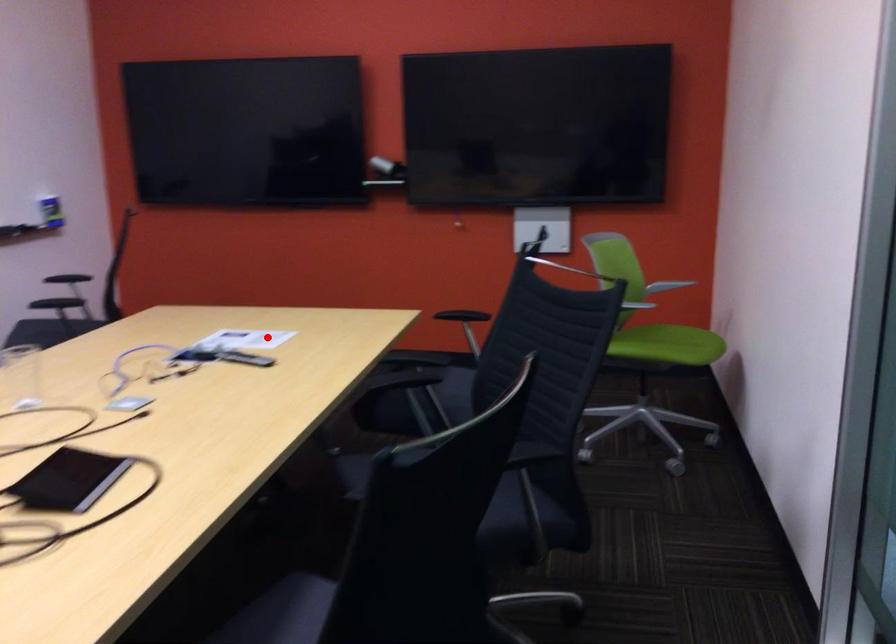
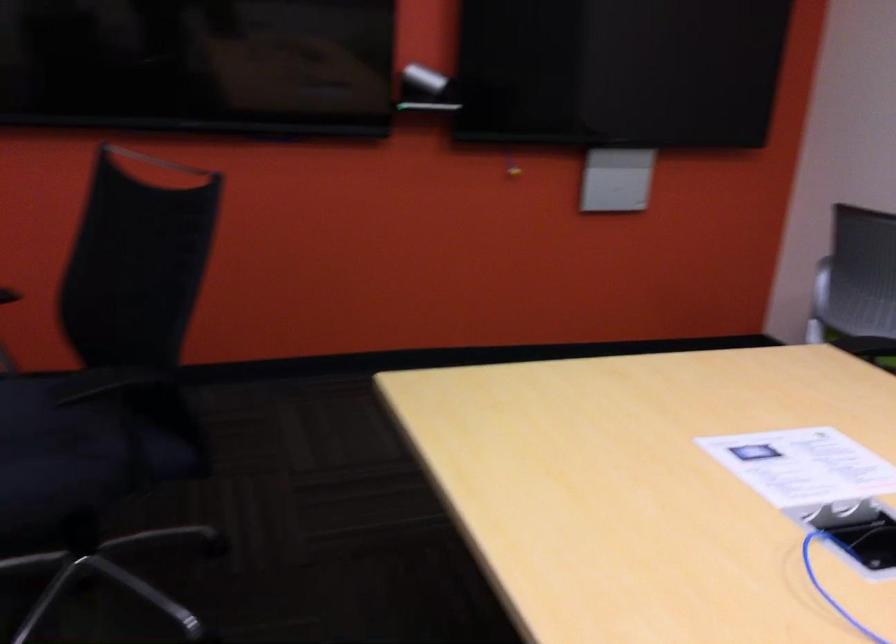
Locate, in the second image, the point that corresponds to the highlighted location in the first image.

(803, 466)